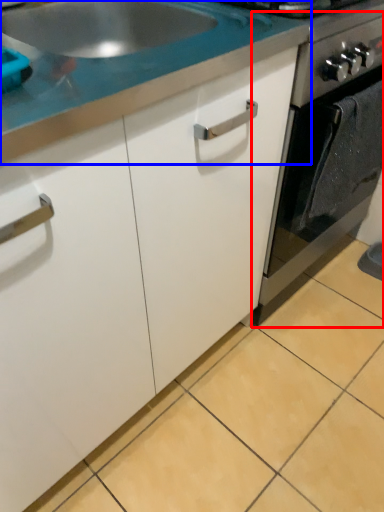
Question: Among these objects, which one is farthest to the camera, oven (highlighted by a red box) or countertop (highlighted by a blue box)?

Choices:
 (A) oven
 (B) countertop

Answer: (A)